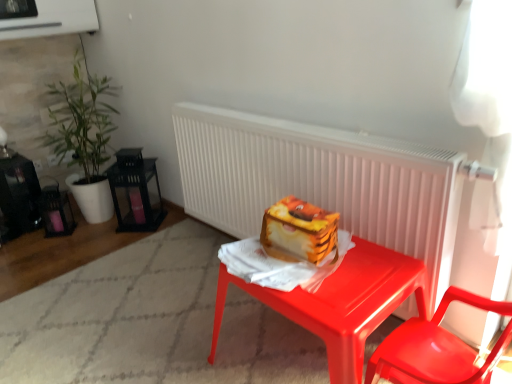
What do you see at coordinates (83, 138) in the screenshot?
I see `green leafy plant at left` at bounding box center [83, 138].

This screenshot has width=512, height=384. Identify the location of white matte radiator at center. (320, 181).

Locate an element on the screen. chair above the glossy plastic desk at center (from a real-world perspective) is located at coordinates (436, 348).

Based on the photo, which of these two, glossy plastic desk at center or glossy plastic chair at lower right, is wider?

glossy plastic desk at center.

Is glossy plastic desk at center touching glossy plastic chair at lower right?

No.

From a real-world perspective, who is located lower, glossy plastic desk at center or glossy plastic chair at lower right?

From a 3D spatial view, glossy plastic desk at center is below.

Is white matte radiator at center positioned behind green leafy plant at left?

No, it is not.

Can you confirm if white matte radiator at center is wider than green leafy plant at left?

No.

Would you say white matte radiator at center is inside or outside green leafy plant at left?

white matte radiator at center cannot be found inside green leafy plant at left.

Locate an element on the screen. Image resolution: width=512 pixels, height=384 pixels. houseplant that appears on the left of white matte radiator at center is located at coordinates (83, 138).

Could you tell me if glossy plastic chair at lower right is facing white matte radiator at center?

Yes, glossy plastic chair at lower right faces towards white matte radiator at center.

In the image, is glossy plastic chair at lower right positioned in front of or behind white matte radiator at center?

Visually, glossy plastic chair at lower right is located in front of white matte radiator at center.

Does glossy plastic chair at lower right have a lesser width compared to white matte radiator at center?

Incorrect, the width of glossy plastic chair at lower right is not less than that of white matte radiator at center.

Is glossy plastic chair at lower right bigger than white matte radiator at center?

No, glossy plastic chair at lower right is not bigger than white matte radiator at center.

Is green leafy plant at left completely or partially outside of glossy plastic desk at center?

green leafy plant at left is positioned outside glossy plastic desk at center.

Considering the relative sizes of green leafy plant at left and glossy plastic desk at center in the image provided, is green leafy plant at left thinner than glossy plastic desk at center?

Yes.

Is green leafy plant at left looking in the opposite direction of glossy plastic desk at center?

No.

Looking at this image, is glossy plastic chair at lower right oriented towards glossy plastic desk at center?

Yes, glossy plastic chair at lower right is oriented towards glossy plastic desk at center.

Is glossy plastic chair at lower right at the left side of glossy plastic desk at center?

In fact, glossy plastic chair at lower right is to the right of glossy plastic desk at center.

Are glossy plastic chair at lower right and glossy plastic desk at center making contact?

No, glossy plastic chair at lower right is not with glossy plastic desk at center.

In the scene shown: Which of these two, green leafy plant at left or glossy plastic chair at lower right, is thinner?

With smaller width is glossy plastic chair at lower right.

The width and height of the screenshot is (512, 384). I want to click on houseplant above the glossy plastic chair at lower right (from the image's perspective), so click(x=83, y=138).

Is green leafy plant at left far from glossy plastic chair at lower right?

green leafy plant at left is far away from glossy plastic chair at lower right.

Is the position of green leafy plant at left less distant than that of glossy plastic chair at lower right?

No, green leafy plant at left is further to the viewer.

Which point is more forward, (240, 134) or (391, 354)?

Positioned in front is point (391, 354).

Does white matte radiator at center have a lesser height compared to glossy plastic chair at lower right?

Incorrect, the height of white matte radiator at center does not fall short of that of glossy plastic chair at lower right.

Find the location of a particular element. chair in front of the white matte radiator at center is located at coordinates (436, 348).

The image size is (512, 384). What are the coordinates of `desk lying behind the glossy plastic chair at lower right` in the screenshot? It's located at coord(342,303).

Find the location of a particular element. houseplant on the left of white matte radiator at center is located at coordinates (83, 138).

Based on their spatial positions, is glossy plastic desk at center or white matte radiator at center closer to glossy plastic chair at lower right?

glossy plastic desk at center is closer to glossy plastic chair at lower right.

Considering their positions, is green leafy plant at left positioned further to glossy plastic desk at center than white matte radiator at center?

Among the two, green leafy plant at left is located further to glossy plastic desk at center.

When comparing their distances from glossy plastic chair at lower right, does white matte radiator at center or glossy plastic desk at center seem closer?

Based on the image, glossy plastic desk at center appears to be nearer to glossy plastic chair at lower right.

Looking at the image, which one is located further to glossy plastic desk at center, green leafy plant at left or glossy plastic chair at lower right?

green leafy plant at left.

Based on their spatial positions, is white matte radiator at center or green leafy plant at left closer to glossy plastic chair at lower right?

The object closer to glossy plastic chair at lower right is white matte radiator at center.

Consider the image. Estimate the real-world distances between objects in this image. Which object is further from green leafy plant at left, white matte radiator at center or glossy plastic chair at lower right?

glossy plastic chair at lower right is further to green leafy plant at left.

Based on their spatial positions, is glossy plastic desk at center or green leafy plant at left further from white matte radiator at center?

green leafy plant at left.

Based on their spatial positions, is white matte radiator at center or green leafy plant at left further from glossy plastic desk at center?

Among the two, green leafy plant at left is located further to glossy plastic desk at center.

Where is `radiator between green leafy plant at left and glossy plastic desk at center from left to right`? The image size is (512, 384). radiator between green leafy plant at left and glossy plastic desk at center from left to right is located at coordinates (320, 181).

The width and height of the screenshot is (512, 384). What are the coordinates of `desk between green leafy plant at left and glossy plastic chair at lower right` in the screenshot? It's located at (342, 303).

I want to click on desk between white matte radiator at center and glossy plastic chair at lower right in the up-down direction, so click(342, 303).

The width and height of the screenshot is (512, 384). In order to click on radiator situated between green leafy plant at left and glossy plastic chair at lower right from left to right in this screenshot , I will do `click(320, 181)`.